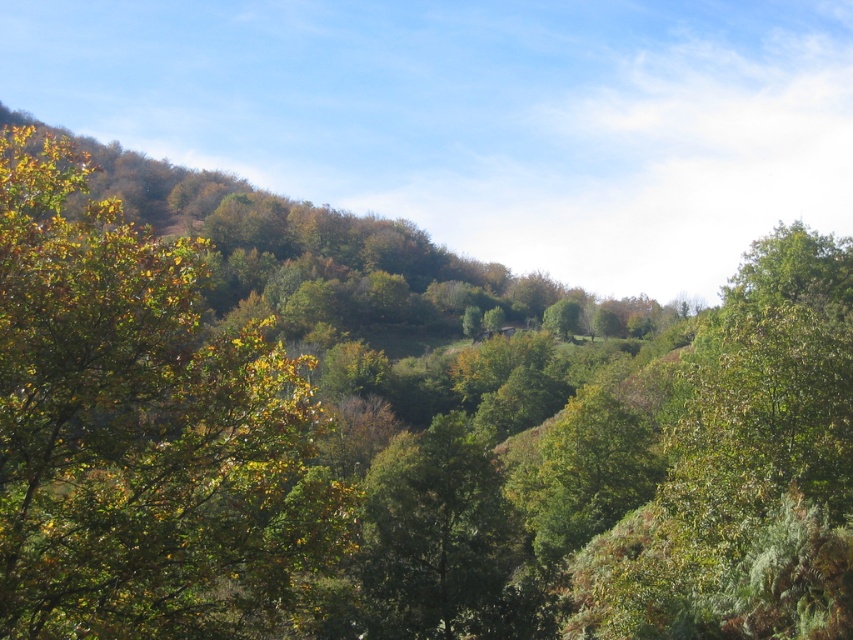
Question: From the image, what is the correct spatial relationship of green leafy tree at left in relation to green leafy tree at center?

Choices:
 (A) right
 (B) left

Answer: (B)

Question: Does green leafy tree at left appear on the right side of green leafy tree at center?

Choices:
 (A) yes
 (B) no

Answer: (B)

Question: Which object appears farthest from the camera in this image?

Choices:
 (A) green leafy tree at center
 (B) green leafy tree at left

Answer: (A)

Question: Which point appears farthest from the camera in this image?

Choices:
 (A) (273, 512)
 (B) (461, 508)

Answer: (B)

Question: Observing the image, what is the correct spatial positioning of green leafy tree at left in reference to green leafy tree at center?

Choices:
 (A) below
 (B) above

Answer: (B)

Question: Which point is farther from the camera taking this photo?

Choices:
 (A) (22, 556)
 (B) (366, 588)

Answer: (B)